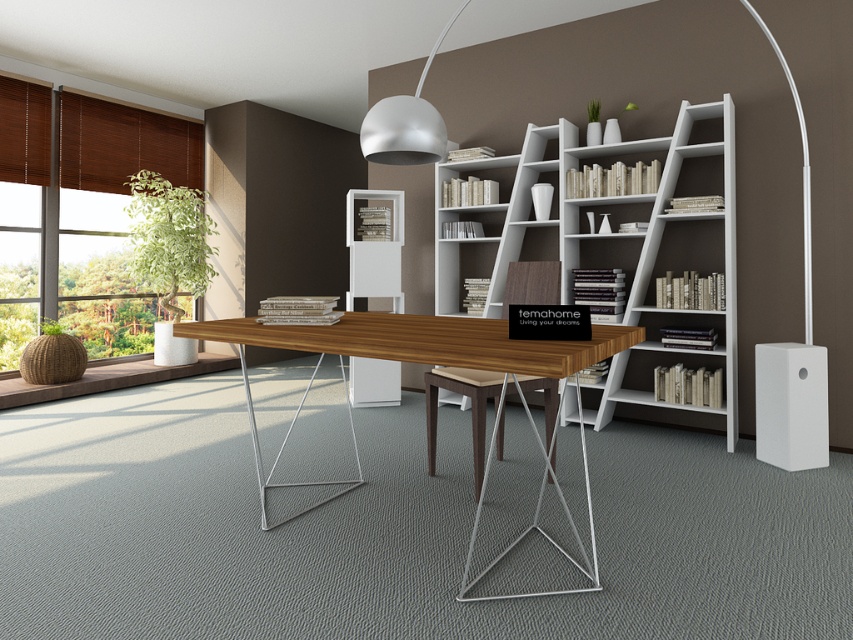
Question: Does white matte bookshelf at center lie behind walnut wood chair at center?

Choices:
 (A) no
 (B) yes

Answer: (B)

Question: Among these points, which one is nearest to the camera?

Choices:
 (A) (532, 260)
 (B) (270, 340)

Answer: (B)

Question: Which point is farther to the camera?

Choices:
 (A) wooden table at center
 (B) walnut wood chair at center
 (C) white matte speaker at lower right
 (D) matte white pendant light at upper center

Answer: (C)

Question: Does wooden table at center have a greater width compared to matte white pendant light at upper center?

Choices:
 (A) no
 (B) yes

Answer: (B)

Question: Is wooden table at center below white matte speaker at lower right?

Choices:
 (A) no
 (B) yes

Answer: (B)

Question: Among these objects, which one is nearest to the camera?

Choices:
 (A) wooden table at center
 (B) white matte bookshelf at center
 (C) white matte speaker at lower right

Answer: (A)